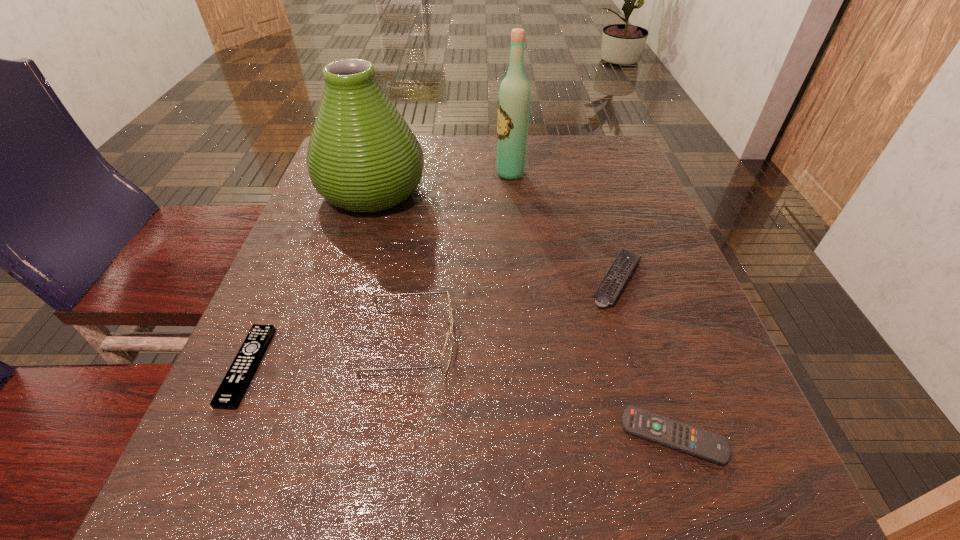
In the image, there is a desktop. At what (x,y) coordinates should I click in order to perform the action: click on free space at the far edge. Please return your answer as a coordinate pair (x, y). Image resolution: width=960 pixels, height=540 pixels. Looking at the image, I should click on (552, 173).

Locate an element on the screen. The height and width of the screenshot is (540, 960). free region at the left edge is located at coordinates (344, 286).

Find the location of a particular element. vacant space at the right edge of the desktop is located at coordinates (702, 394).

Image resolution: width=960 pixels, height=540 pixels. What are the coordinates of `free point at the near left corner` in the screenshot? It's located at (209, 488).

At what (x,y) coordinates should I click in order to perform the action: click on free space at the far right corner of the desktop. Please return your answer as a coordinate pair (x, y). Looking at the image, I should click on 596,143.

Identify the location of empty space that is in between the fourth shortest object and the leftmost remote control. The width and height of the screenshot is (960, 540). (328, 352).

At what (x,y) coordinates should I click in order to perform the action: click on free point between the leftmost remote control and the fourth object from left to right. Please return your answer as a coordinate pair (x, y). The height and width of the screenshot is (540, 960). Looking at the image, I should click on (378, 270).

You are a GUI agent. You are given a task and a screenshot of the screen. Output one action in this format:
    pyautogui.click(x=<x>, y=<y>)
    Task: Click on the vacant region between the spectacles and the fourth tallest object
    
    Given the screenshot: What is the action you would take?
    pyautogui.click(x=514, y=309)

The width and height of the screenshot is (960, 540). Identify the location of empty space that is in between the fourth tallest object and the third object from right to left. (564, 227).

Find the location of a particular element. This screenshot has height=540, width=960. empty location between the leftmost remote control and the vase is located at coordinates (310, 279).